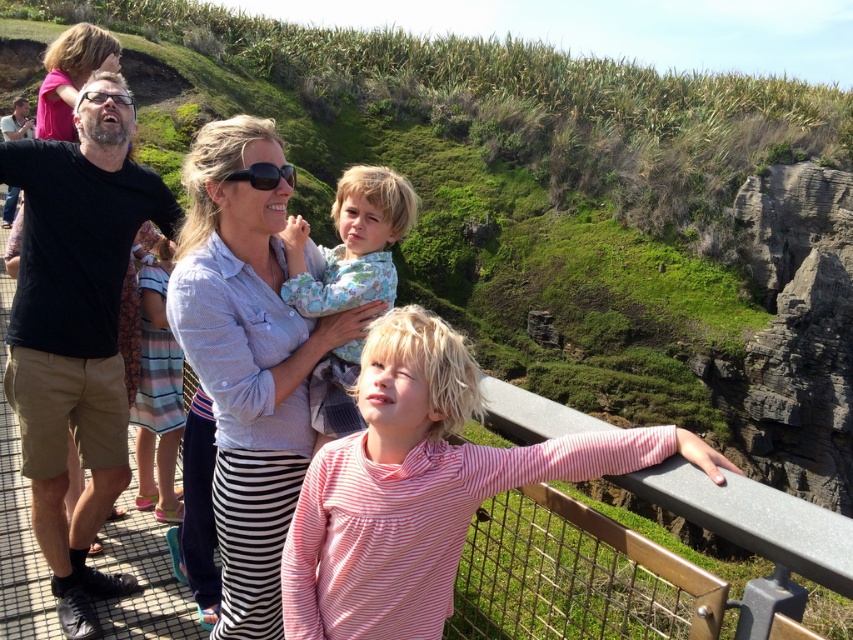
You are a photographer standing in front of the scenic overlook. You see the black cotton shirt at left and the black matte sunglasses at center. Which object is closer to you?

The black cotton shirt at left is closer to you because it is further to the viewer than the black matte sunglasses at center.

You are a photographer trying to capture a group photo of the light blue shirt at center and the matte black shirt at left. Which shirt should you position to the left side of the frame to align with their current arrangement?

The matte black shirt at left should be positioned to the left side of the frame because the light blue shirt at center is currently on the right side of the matte black shirt at left, so placing the matte black shirt at left on the left maintains their existing arrangement.

You are a photographer trying to capture the light blue shirt at center and the matte black shirt at left in a single shot. Which shirt should you focus on first to ensure both are in frame?

The light blue shirt at center is positioned under the matte black shirt at left, so you should focus on the matte black shirt at left first to ensure both are in frame.